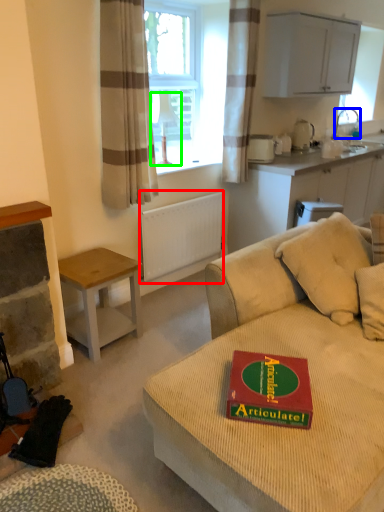
Question: Estimate the real-world distances between objects in this image. Which object is farther from radiator (highlighted by a red box), faucet (highlighted by a blue box) or lamp (highlighted by a green box)?

Choices:
 (A) faucet
 (B) lamp

Answer: (A)